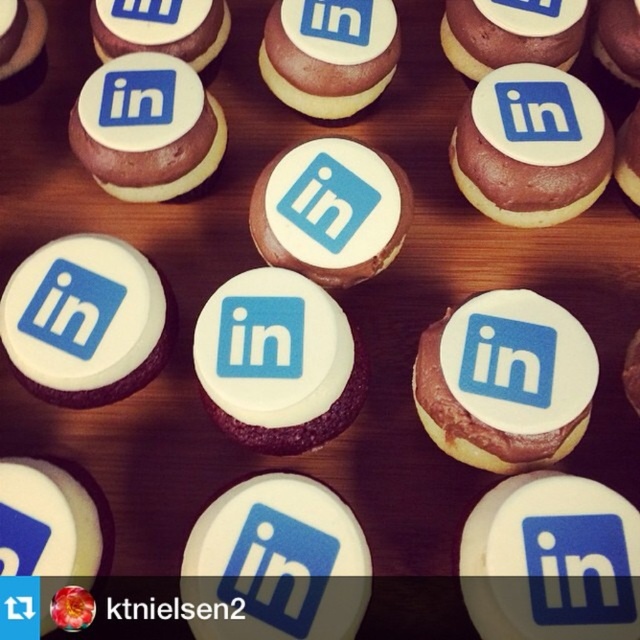
You are a baker who needs to place a decorative strawberry on the exact center of the chocolate cookie. Given that the coordinate system starts at the bottom left corner of the image, can you confirm if the point at coordinate point [328,52] is the center of the chocolate cookie?

The point [328,52] is on the matte chocolate cookie at center, so yes, placing the strawberry at that coordinate would be on the center of the chocolate cookie.

You are a baker who needs to place a 10 inch wide cake on the table. You see the matte chocolate cookie at center and the matte chocolate cupcake at upper center. Can the cake fit between them without overlapping?

The distance between the matte chocolate cookie at center and the matte chocolate cupcake at upper center is 9.61 inches. Since the cake is 10 inches wide, it cannot fit between them without overlapping.

From the picture: You are a baker who wants to ensure proper portion control. You have two cupcakes in front of you, the matte chocolate cupcake at upper right and the white glossy cupcake at center. Which one requires more frosting based on their size?

The matte chocolate cupcake at upper right requires more frosting because it is larger in size than the white glossy cupcake at center.